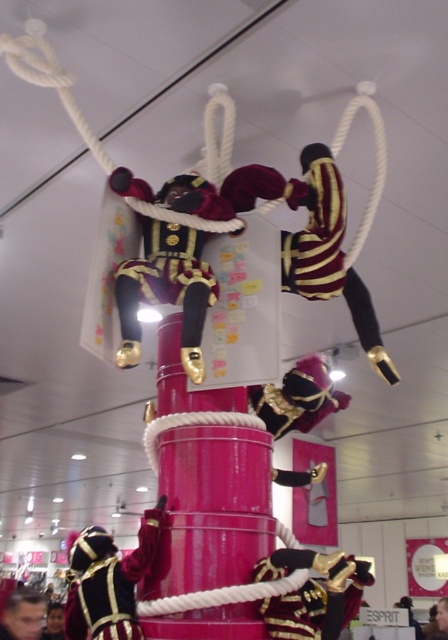
Does shiny gold uniform at center appear on the right side of smooth skin face at lower left?

Yes, shiny gold uniform at center is to the right of smooth skin face at lower left.

The image size is (448, 640). I want to click on shiny gold uniform at center, so click(x=167, y=280).

Image resolution: width=448 pixels, height=640 pixels. In order to click on shiny gold uniform at center in this screenshot , I will do `click(167, 280)`.

Which is below, striped velvet pants at center or smooth skin face at lower left?

Positioned lower is smooth skin face at lower left.

Which is more to the right, striped velvet pants at center or smooth skin face at lower left?

striped velvet pants at center

This screenshot has width=448, height=640. What are the coordinates of `striped velvet pants at center` in the screenshot? It's located at (326, 248).

Between shiny gold uniform at center and velvet gold uniform at lower left, which one is positioned higher?

shiny gold uniform at center

Which is in front, point (137, 289) or point (81, 563)?

Point (137, 289) is in front.

Locate an element on the screen. The height and width of the screenshot is (640, 448). shiny gold uniform at center is located at coordinates (167, 280).